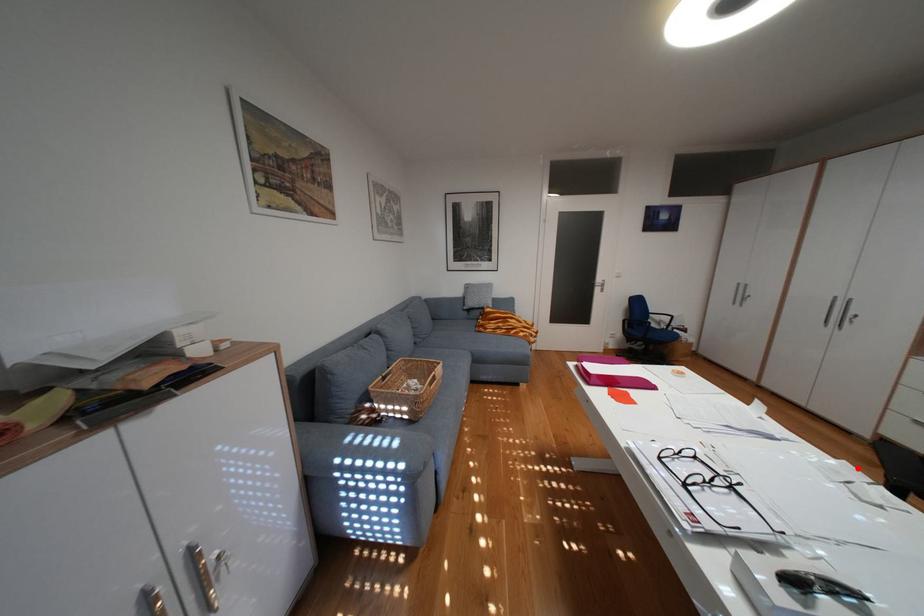
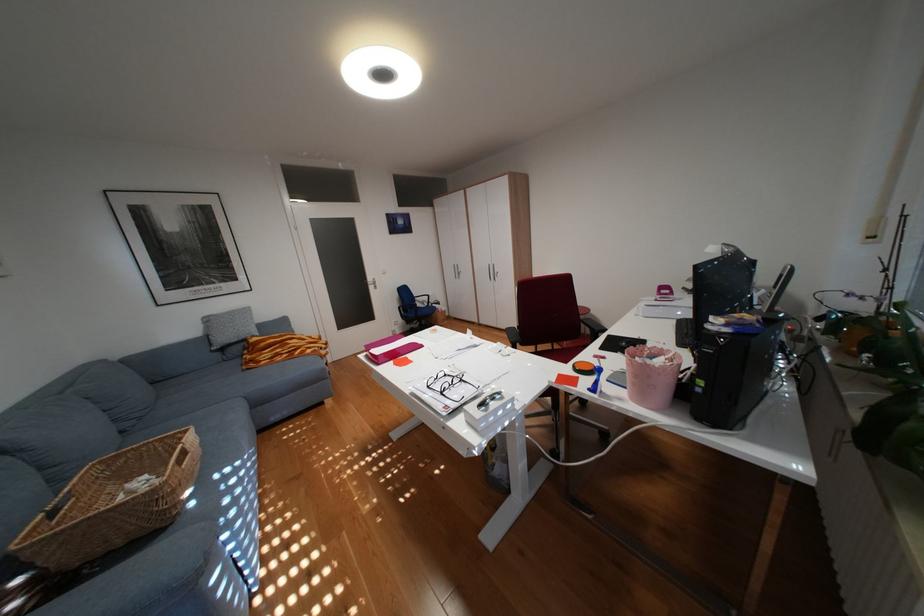
Question: A red point is marked in image1. In image2, is the corresponding 3D point closer to the camera or farther? Reply with the corresponding letter.

Choices:
 (A) The corresponding 3D point is closer.
 (B) The corresponding 3D point is farther.

Answer: (B)